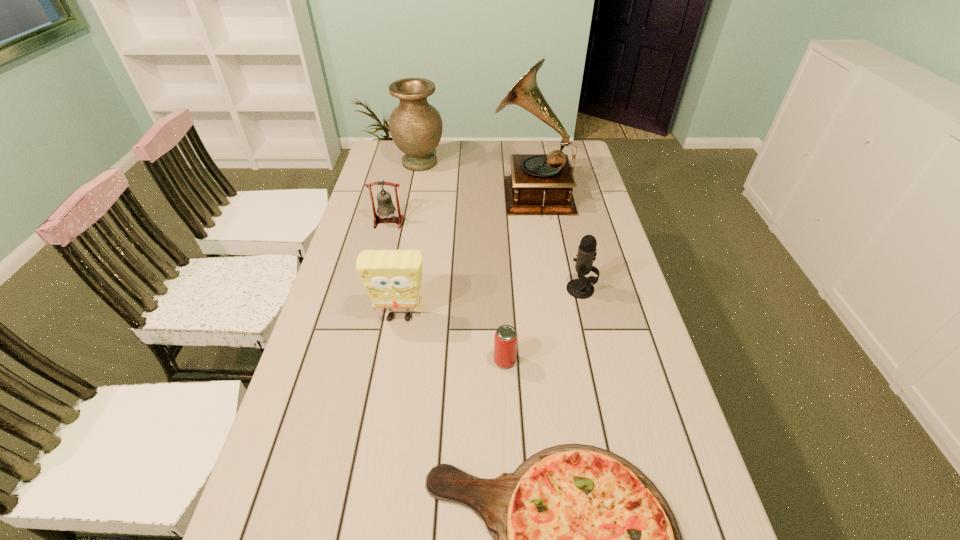
Image resolution: width=960 pixels, height=540 pixels. I want to click on the tallest object, so click(x=539, y=183).

Find the location of a particular element. The image size is (960, 540). the second tallest object is located at coordinates (416, 126).

Where is `the third nearest object`? The width and height of the screenshot is (960, 540). the third nearest object is located at coordinates (392, 278).

I want to click on microphone, so click(581, 288).

Where is `bell`? This screenshot has height=540, width=960. bell is located at coordinates (385, 207).

Find the location of `the second shortest object`. the second shortest object is located at coordinates (505, 341).

Identify the location of beer can. The image size is (960, 540). (505, 341).

You are a GUI agent. You are given a task and a screenshot of the screen. Output one action in this format:
    pyautogui.click(x=<x>, y=<y>)
    Task: Click on the free space located 0.400m on the horn of the tallest object
    This screenshot has height=540, width=960.
    Given the screenshot: What is the action you would take?
    pyautogui.click(x=388, y=192)

The height and width of the screenshot is (540, 960). I want to click on free spot located 0.170m on the horn of the tallest object, so click(x=448, y=192).

In order to click on blank area located 0.210m on the horn of the tallest object in this screenshot , I will do `click(438, 192)`.